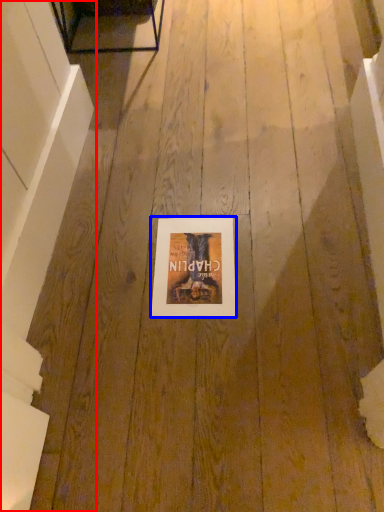
Question: Among these objects, which one is nearest to the camera, stairwell (highlighted by a red box) or picture frame (highlighted by a blue box)?

Choices:
 (A) stairwell
 (B) picture frame

Answer: (A)